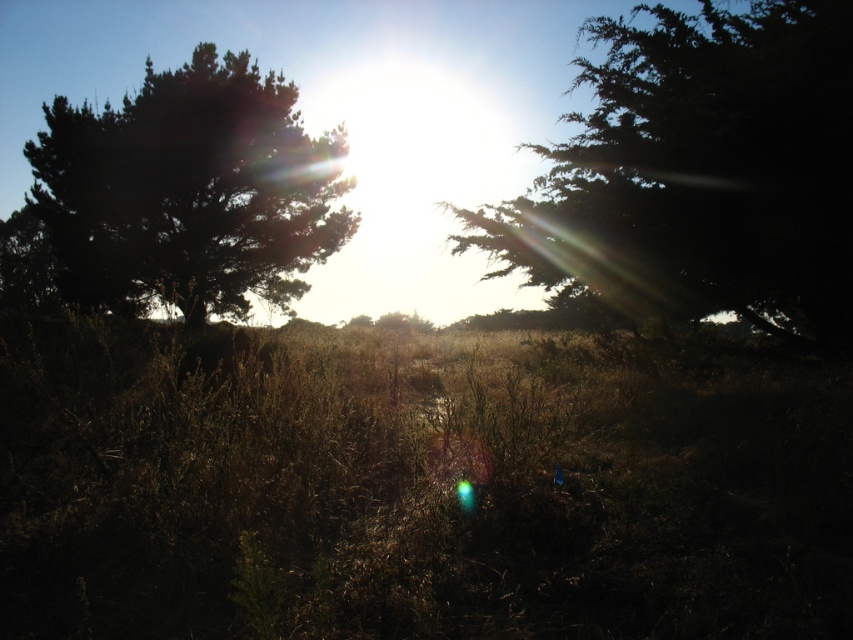
Does dark green textured tree at upper right come behind dark green textured tree at left?

That is False.

Is dark green textured tree at upper right wider than dark green textured tree at left?

Yes, dark green textured tree at upper right is wider than dark green textured tree at left.

Between point (799, 211) and point (78, 134), which one is positioned in front?

Point (799, 211) is more forward.

You are a GUI agent. You are given a task and a screenshot of the screen. Output one action in this format:
    pyautogui.click(x=<x>, y=<y>)
    Task: Click on the dark green textured tree at upper right
    
    Given the screenshot: What is the action you would take?
    pyautogui.click(x=701, y=172)